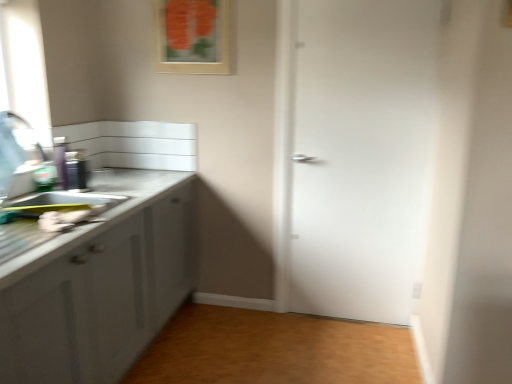
Question: Does metallic canister at left have a greater width compared to matte white sink at left?

Choices:
 (A) no
 (B) yes

Answer: (A)

Question: Is metallic canister at left positioned far away from matte white sink at left?

Choices:
 (A) no
 (B) yes

Answer: (A)

Question: Considering the relative positions of metallic canister at left and matte white sink at left in the image provided, is metallic canister at left behind matte white sink at left?

Choices:
 (A) no
 (B) yes

Answer: (B)

Question: Does metallic canister at left appear on the right side of matte white sink at left?

Choices:
 (A) no
 (B) yes

Answer: (A)

Question: Is metallic canister at left closer to the viewer compared to matte white sink at left?

Choices:
 (A) no
 (B) yes

Answer: (A)

Question: Is brushed metal faucet at left taller or shorter than metallic canister at left?

Choices:
 (A) tall
 (B) short

Answer: (A)

Question: Do you think brushed metal faucet at left is within metallic canister at left, or outside of it?

Choices:
 (A) outside
 (B) inside

Answer: (A)

Question: From the image's perspective, is brushed metal faucet at left located above or below metallic canister at left?

Choices:
 (A) above
 (B) below

Answer: (A)

Question: Is point (27, 145) positioned closer to the camera than point (74, 175)?

Choices:
 (A) farther
 (B) closer

Answer: (B)

Question: Is white matte door at center inside or outside of wooden floor at lower center?

Choices:
 (A) inside
 (B) outside

Answer: (B)

Question: In terms of height, does white matte door at center look taller or shorter compared to wooden floor at lower center?

Choices:
 (A) tall
 (B) short

Answer: (A)

Question: In the image, is white matte door at center positioned in front of or behind wooden floor at lower center?

Choices:
 (A) front
 (B) behind

Answer: (B)

Question: Is white matte door at center wider or thinner than wooden floor at lower center?

Choices:
 (A) wide
 (B) thin

Answer: (B)

Question: Based on their positions, is metallic canister at left located to the left or right of brushed metal faucet at left?

Choices:
 (A) left
 (B) right

Answer: (B)

Question: Is point (65, 152) closer or farther from the camera than point (16, 142)?

Choices:
 (A) closer
 (B) farther

Answer: (B)